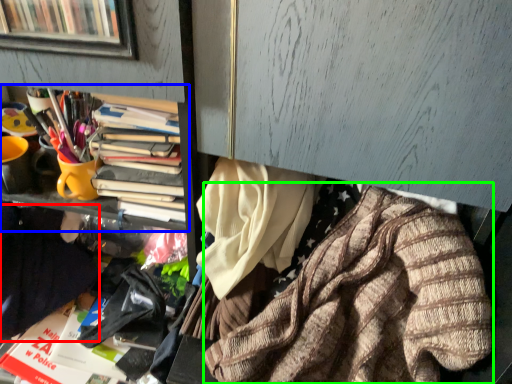
Question: Estimate the real-world distances between objects in this image. Which object is closer to clothing (highlighted by a red box), bookcase (highlighted by a blue box) or clothing (highlighted by a green box)?

Choices:
 (A) bookcase
 (B) clothing

Answer: (A)